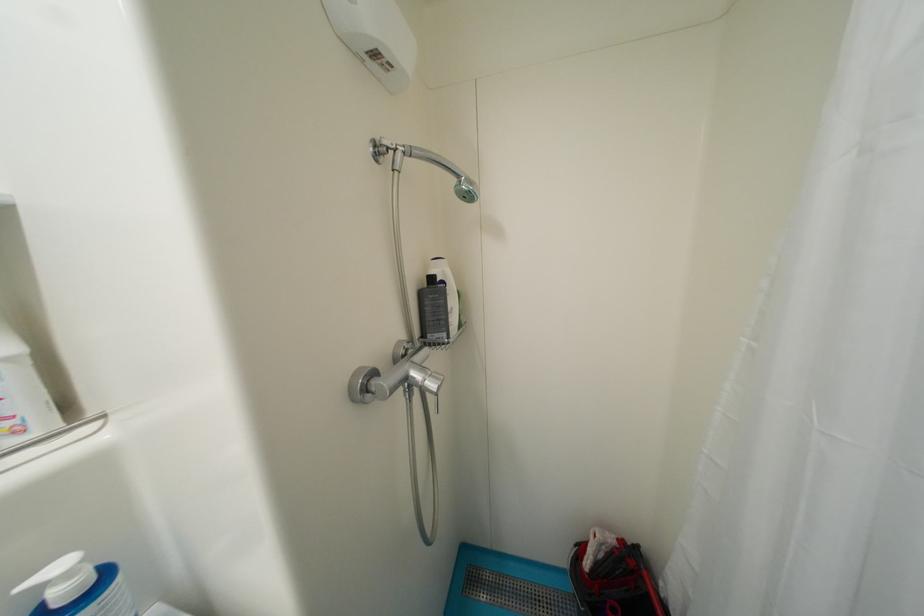
Find where to pull the faucet diverter pull. Please return your answer as a coordinate pair (x, y).

(392, 381)